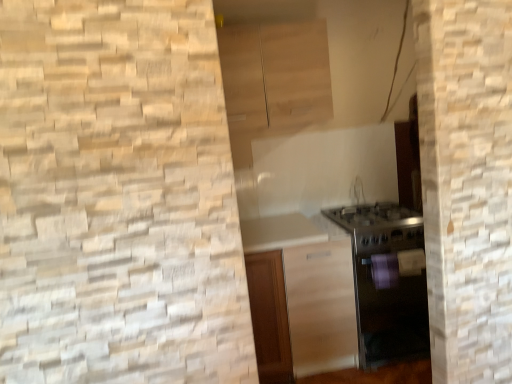
Question: Should I look upward or downward to see light wood cabinet at upper center, acting as the first cabinetry starting from the top?

Choices:
 (A) down
 (B) up

Answer: (B)

Question: Is satin silver oven at lower right behind light wood cabinet at upper center, acting as the first cabinetry starting from the top?

Choices:
 (A) yes
 (B) no

Answer: (B)

Question: From a real-world perspective, is satin silver oven at lower right on top of light wood cabinet at upper center, acting as the first cabinetry starting from the top?

Choices:
 (A) yes
 (B) no

Answer: (B)

Question: Is light wood cabinet at upper center, acting as the first cabinetry starting from the top, at the back of satin silver oven at lower right?

Choices:
 (A) yes
 (B) no

Answer: (B)

Question: From the image's perspective, is satin silver oven at lower right below light wood cabinet at upper center, acting as the first cabinetry starting from the top?

Choices:
 (A) no
 (B) yes

Answer: (B)

Question: Is light wood cabinet at upper center, which appears as the second cabinetry when ordered from the bottom, completely or partially inside satin silver oven at lower right?

Choices:
 (A) yes
 (B) no

Answer: (B)

Question: From the image's perspective, is satin silver oven at lower right over light wood cabinet at upper center, which appears as the second cabinetry when ordered from the bottom?

Choices:
 (A) no
 (B) yes

Answer: (A)

Question: Is light wood cabinet at upper center, which appears as the second cabinetry when ordered from the bottom, with satin wood cabinet at center, marked as the second cabinetry in a top-to-bottom arrangement?

Choices:
 (A) no
 (B) yes

Answer: (A)

Question: Does light wood cabinet at upper center, which appears as the second cabinetry when ordered from the bottom, appear on the right side of satin wood cabinet at center, marked as the second cabinetry in a top-to-bottom arrangement?

Choices:
 (A) yes
 (B) no

Answer: (B)

Question: Can you confirm if light wood cabinet at upper center, acting as the first cabinetry starting from the top, is smaller than satin wood cabinet at center, placed as the first cabinetry when sorted from bottom to top?

Choices:
 (A) yes
 (B) no

Answer: (A)

Question: Considering the relative sizes of light wood cabinet at upper center, acting as the first cabinetry starting from the top, and satin wood cabinet at center, marked as the second cabinetry in a top-to-bottom arrangement, in the image provided, is light wood cabinet at upper center, acting as the first cabinetry starting from the top, taller than satin wood cabinet at center, marked as the second cabinetry in a top-to-bottom arrangement,?

Choices:
 (A) yes
 (B) no

Answer: (B)

Question: From the image's perspective, is light wood cabinet at upper center, acting as the first cabinetry starting from the top, on top of satin wood cabinet at center, placed as the first cabinetry when sorted from bottom to top?

Choices:
 (A) yes
 (B) no

Answer: (A)

Question: From a real-world perspective, is light wood cabinet at upper center, which appears as the second cabinetry when ordered from the bottom, physically below satin wood cabinet at center, marked as the second cabinetry in a top-to-bottom arrangement?

Choices:
 (A) no
 (B) yes

Answer: (A)

Question: Is satin wood cabinet at center, marked as the second cabinetry in a top-to-bottom arrangement, wider than light wood cabinet at upper center, acting as the first cabinetry starting from the top?

Choices:
 (A) no
 (B) yes

Answer: (B)